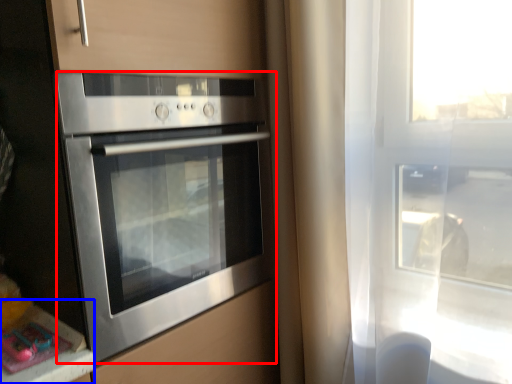
Question: Which point is closer to the camera, oven (highlighted by a red box) or counter top (highlighted by a blue box)?

Choices:
 (A) oven
 (B) counter top

Answer: (A)